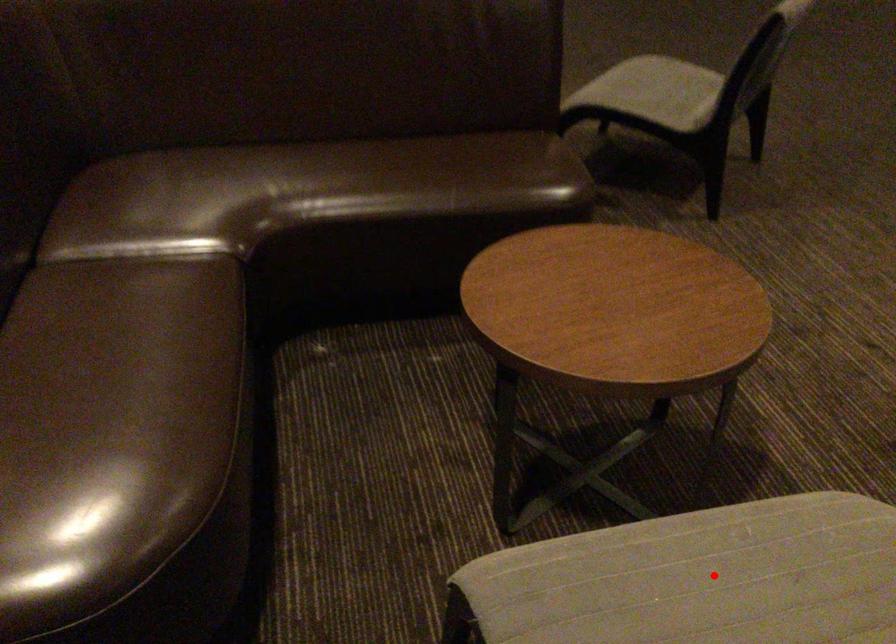
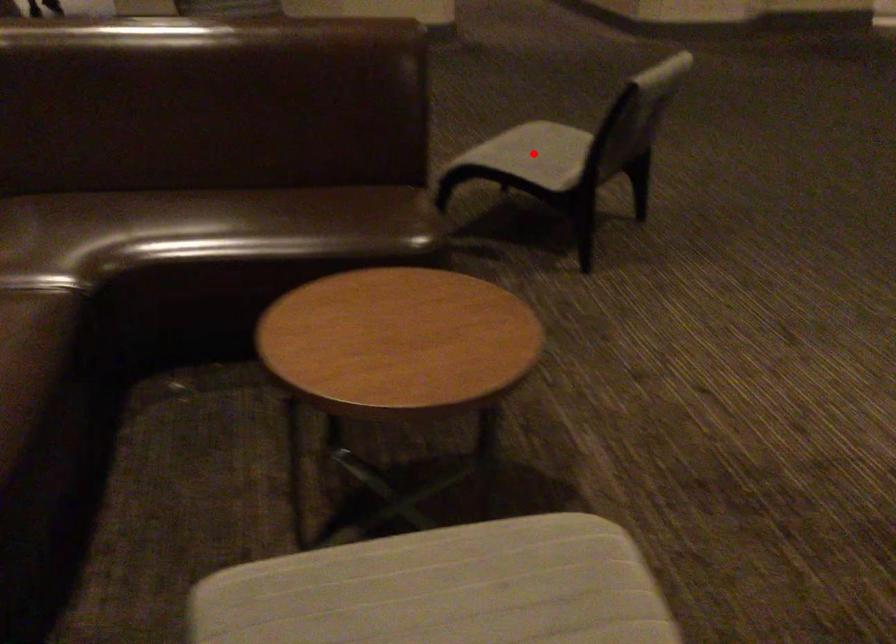
I am providing you with two images of the same scene from different viewpoints. A red point is marked on the first image and another point is marked on the second image. Is the red point in image1 aligned with the point shown in image2?

No